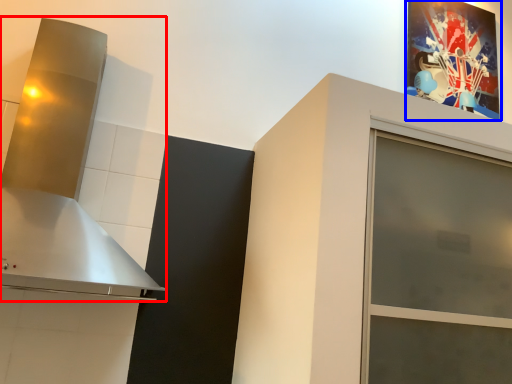
Question: Which point is further to the camera, vent (highlighted by a red box) or picture frame (highlighted by a blue box)?

Choices:
 (A) vent
 (B) picture frame

Answer: (B)